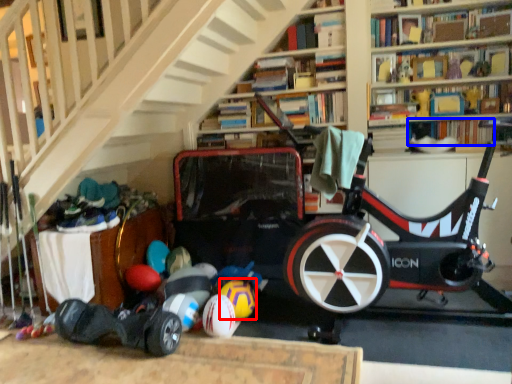
Question: Which object appears farthest to the camera in this image, beach ball (highlighted by a red box) or book (highlighted by a blue box)?

Choices:
 (A) beach ball
 (B) book

Answer: (B)